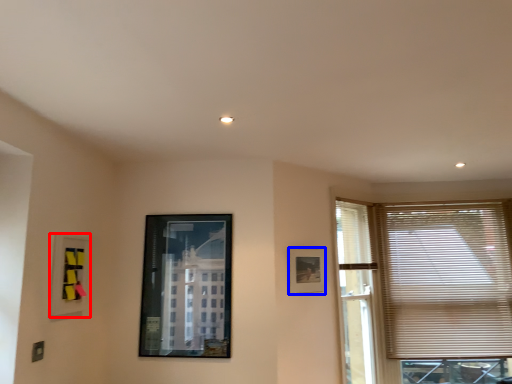
Question: Among these objects, which one is farthest to the camera, picture frame (highlighted by a red box) or picture frame (highlighted by a blue box)?

Choices:
 (A) picture frame
 (B) picture frame

Answer: (B)